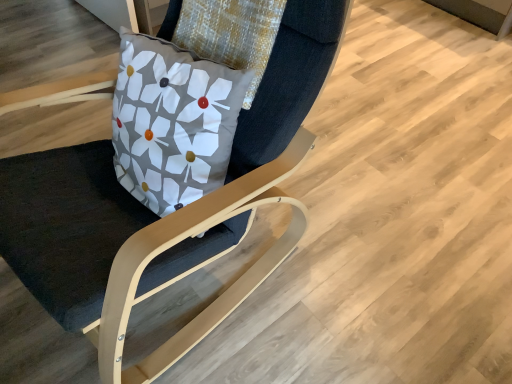
Describe the element at coordinates (167, 217) in the screenshot. I see `matte wood chair at center` at that location.

Image resolution: width=512 pixels, height=384 pixels. I want to click on matte wood chair at center, so click(x=167, y=217).

Identify the location of matte wood chair at center. (167, 217).